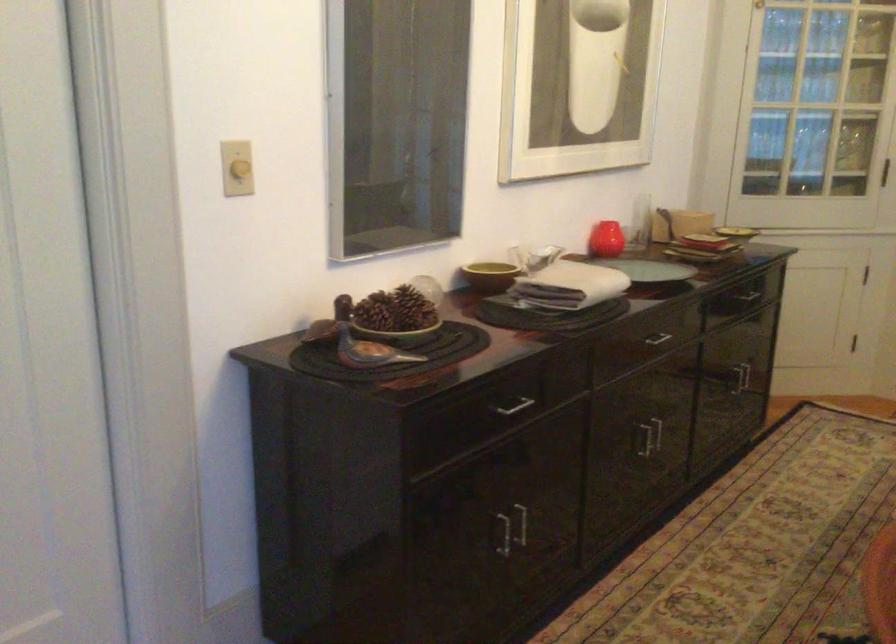
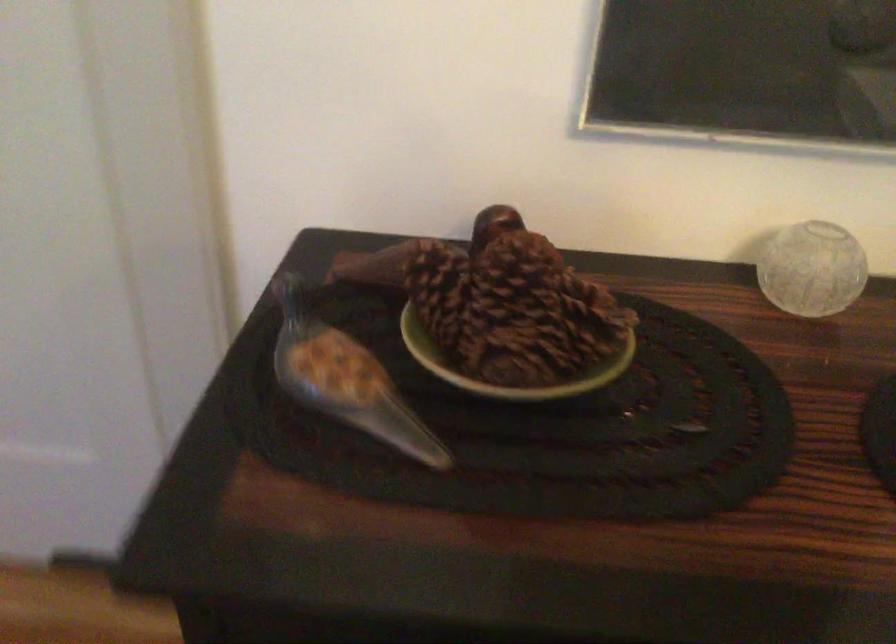
Where in the second image is the point corresponding to [366,310] from the first image?

(440, 292)